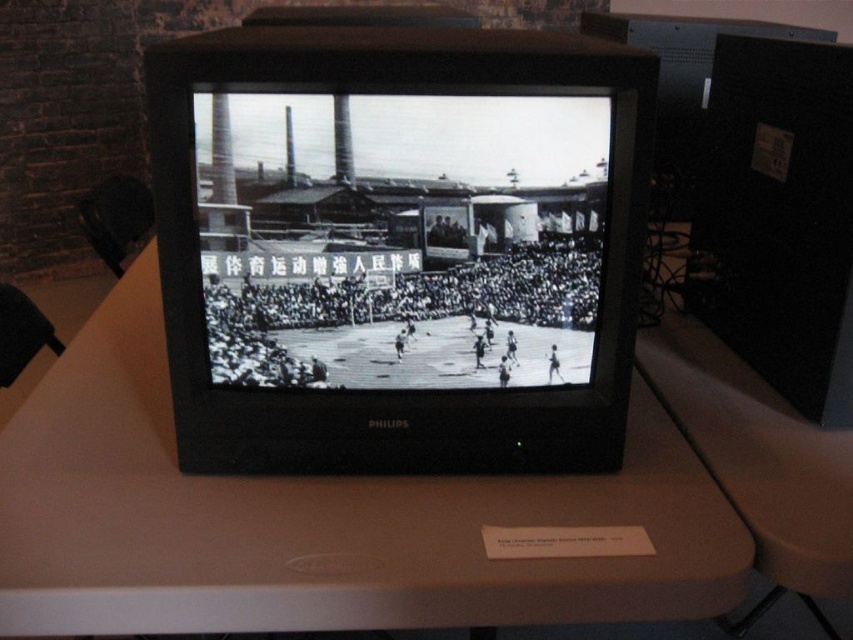
Question: Which of the following is the closest to the observer?

Choices:
 (A) (397, 145)
 (B) (386, 483)

Answer: (A)

Question: Can you confirm if white matte table at center is smaller than black and white basketball court at center?

Choices:
 (A) yes
 (B) no

Answer: (B)

Question: Does white matte table at center have a lesser width compared to black and white basketball court at center?

Choices:
 (A) yes
 (B) no

Answer: (B)

Question: Which point appears closest to the camera in this image?

Choices:
 (A) (415, 220)
 (B) (747, 563)

Answer: (B)

Question: Where is white matte table at center located in relation to black and white basketball court at center in the image?

Choices:
 (A) left
 (B) right

Answer: (A)